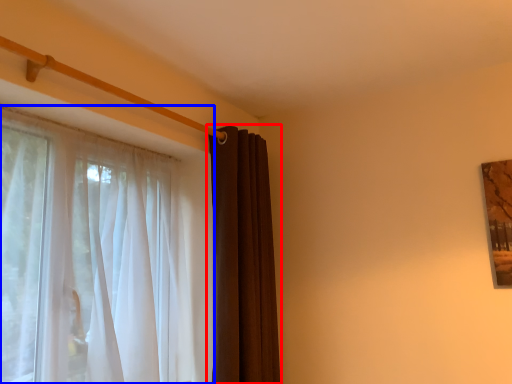
Question: Among these objects, which one is nearest to the camera, curtain (highlighted by a red box) or curtain (highlighted by a blue box)?

Choices:
 (A) curtain
 (B) curtain

Answer: (B)